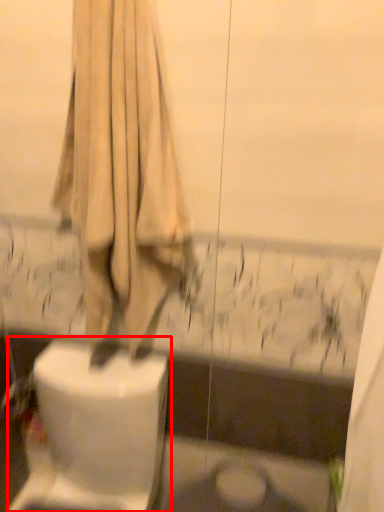
Question: From the image, what is the correct spatial relationship of toilet (annotated by the red box) in relation to curtain?

Choices:
 (A) left
 (B) right

Answer: (A)